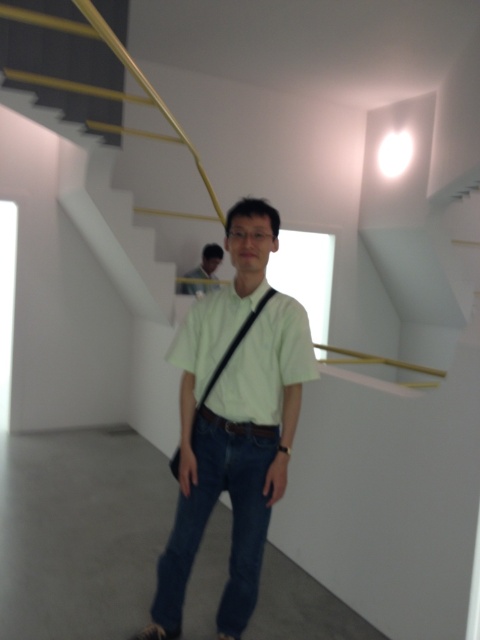
Question: Observing the image, what is the correct spatial positioning of white matte stairs at upper center in reference to matte black shirt at center?

Choices:
 (A) below
 (B) above

Answer: (B)

Question: Considering the relative positions of light green shirt at center and matte black shirt at center in the image provided, where is light green shirt at center located with respect to matte black shirt at center?

Choices:
 (A) above
 (B) below

Answer: (B)

Question: Estimate the real-world distances between objects in this image. Which object is closer to the matte black shirt at center?

Choices:
 (A) light green shirt at center
 (B) denim at center
 (C) light green cotton shirt at center

Answer: (C)

Question: Can you confirm if light green cotton shirt at center is positioned above green fabric strap at center?

Choices:
 (A) no
 (B) yes

Answer: (B)

Question: Which of the following is the farthest from the observer?

Choices:
 (A) matte black shirt at center
 (B) white matte stairs at upper center

Answer: (A)

Question: Which object is positioned closest to the white matte stairs at upper center?

Choices:
 (A) light green cotton shirt at center
 (B) matte black shirt at center

Answer: (B)